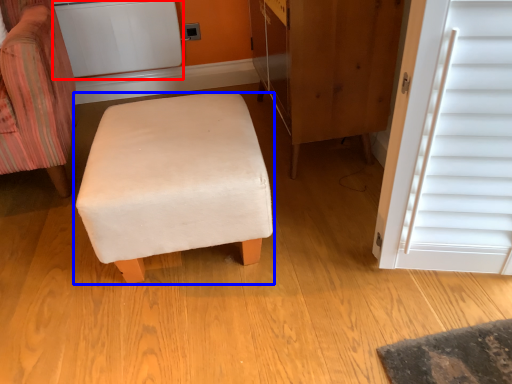
Question: Which object is further to the camera taking this photo, appliance (highlighted by a red box) or furniture (highlighted by a blue box)?

Choices:
 (A) appliance
 (B) furniture

Answer: (A)